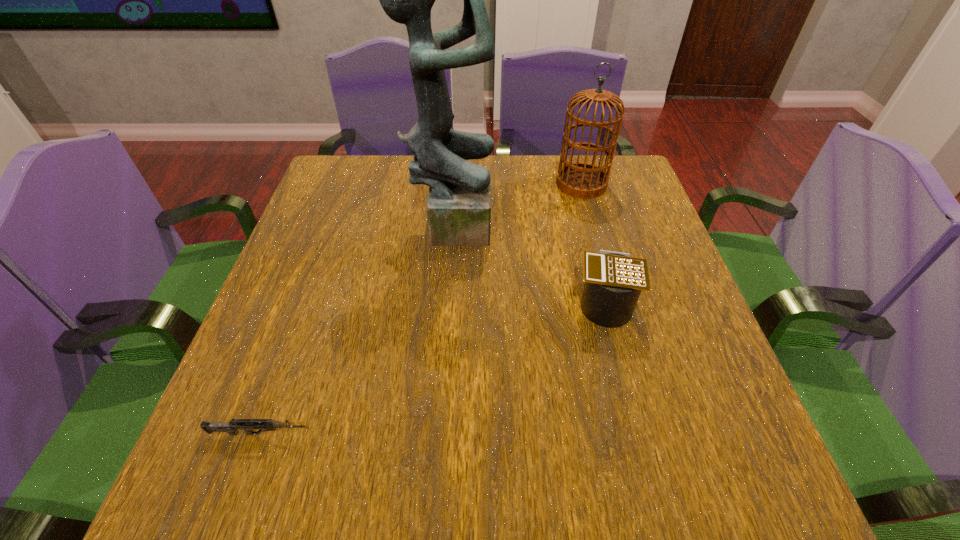
The height and width of the screenshot is (540, 960). What are the coordinates of `vacant position at the far left corner of the desktop` in the screenshot? It's located at (372, 160).

Find the location of a particular element. The image size is (960, 540). vacant area at the far right corner is located at coordinates (592, 199).

In the image, there is a desktop. Identify the location of vacant space at the near right corner. This screenshot has height=540, width=960. (684, 454).

Where is `blank region between the gun and the birdcage`? This screenshot has width=960, height=540. blank region between the gun and the birdcage is located at coordinates (420, 309).

Image resolution: width=960 pixels, height=540 pixels. I want to click on blank region between the birdcage and the sculpture, so click(x=516, y=203).

Where is `empty space that is in between the third tallest object and the shortest object`? The height and width of the screenshot is (540, 960). empty space that is in between the third tallest object and the shortest object is located at coordinates (432, 368).

This screenshot has height=540, width=960. Identify the location of free space between the sculpture and the third tallest object. (528, 261).

Image resolution: width=960 pixels, height=540 pixels. Identify the location of unoccupied area between the second shortest object and the leftmost object. (432, 368).

Image resolution: width=960 pixels, height=540 pixels. In order to click on vacant space that is in between the nearest object and the calculator in this screenshot , I will do `click(432, 368)`.

This screenshot has width=960, height=540. I want to click on unoccupied position between the tallest object and the second nearest object, so click(x=528, y=261).